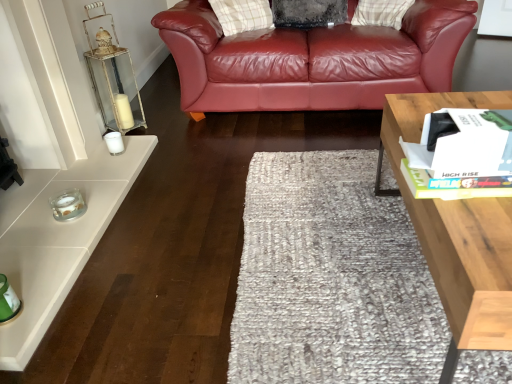
Identify the location of empty space that is to the right of clear glass candle at lower left, which is counted as the 1th candle holder, starting from the bottom. Image resolution: width=512 pixels, height=384 pixels. (123, 222).